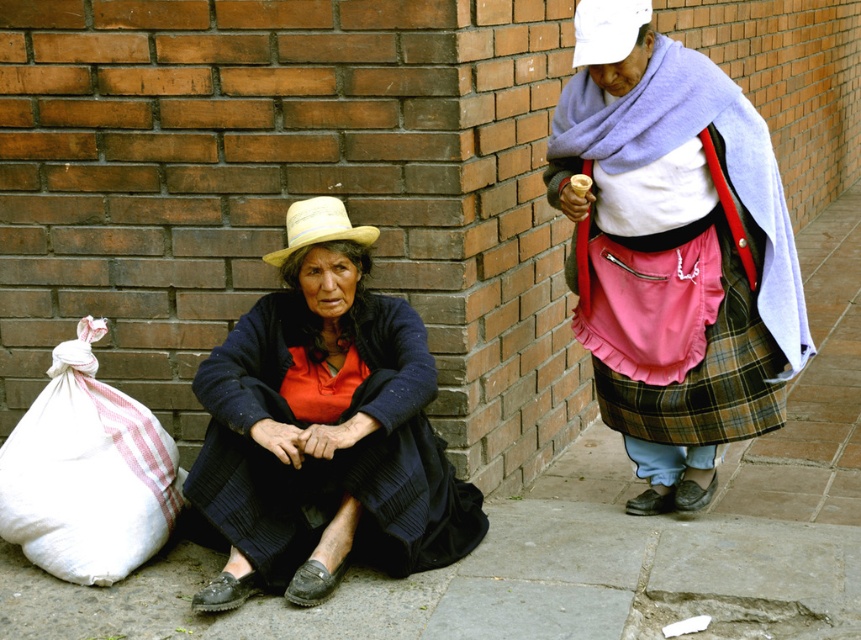
Question: Considering the real-world distances, which object is closest to the white woven bag at lower left?

Choices:
 (A) straw woven cowboy hat at lower left
 (B) white fabric hat at upper center
 (C) knitted dark blue sweater at lower left

Answer: (C)

Question: Estimate the real-world distances between objects in this image. Which object is farther from the plaid skirt at center?

Choices:
 (A) white woven bag at lower left
 (B) gray concrete pavement at lower center
 (C) straw woven cowboy hat at lower left

Answer: (A)

Question: Can you confirm if gray concrete pavement at lower center is positioned to the left of white woven bag at lower left?

Choices:
 (A) yes
 (B) no

Answer: (B)

Question: Is plaid skirt at center below straw woven cowboy hat at lower left?

Choices:
 (A) no
 (B) yes

Answer: (B)

Question: Which of the following is the closest to the observer?

Choices:
 (A) knitted dark blue sweater at lower left
 (B) straw woven cowboy hat at lower left
 (C) gray concrete pavement at lower center

Answer: (C)

Question: Is plaid skirt at center closer to the viewer compared to white woven bag at lower left?

Choices:
 (A) no
 (B) yes

Answer: (A)